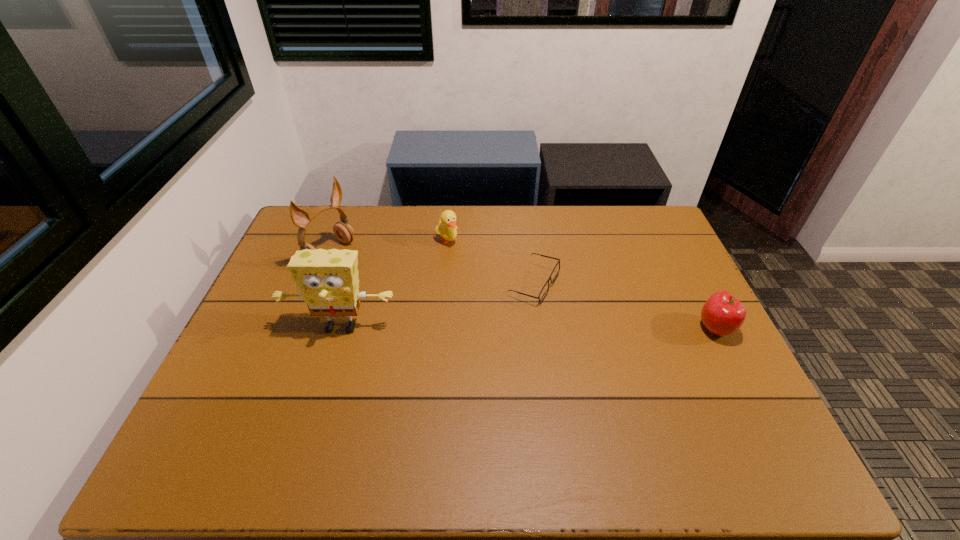
The height and width of the screenshot is (540, 960). Identify the location of object that is the third closest to the rightmost object. (328, 282).

Image resolution: width=960 pixels, height=540 pixels. Find the location of `free location that satisfies the following two spatial constraints: 1. on the front side of the second object from right to left; 2. on the left side of the apple`. free location that satisfies the following two spatial constraints: 1. on the front side of the second object from right to left; 2. on the left side of the apple is located at coordinates (540, 328).

Locate an element on the screen. The image size is (960, 540). free space that satisfies the following two spatial constraints: 1. on the front side of the fourth object from left to right; 2. on the right side of the apple is located at coordinates (540, 328).

Find the location of a particular element. The height and width of the screenshot is (540, 960). vacant space that satisfies the following two spatial constraints: 1. on the front side of the shortest object; 2. on the right side of the rightmost object is located at coordinates (540, 328).

Where is `free space in the image that satisfies the following two spatial constraints: 1. on the front side of the third object from left to right; 2. on the right side of the spectacles`? free space in the image that satisfies the following two spatial constraints: 1. on the front side of the third object from left to right; 2. on the right side of the spectacles is located at coordinates pyautogui.click(x=443, y=284).